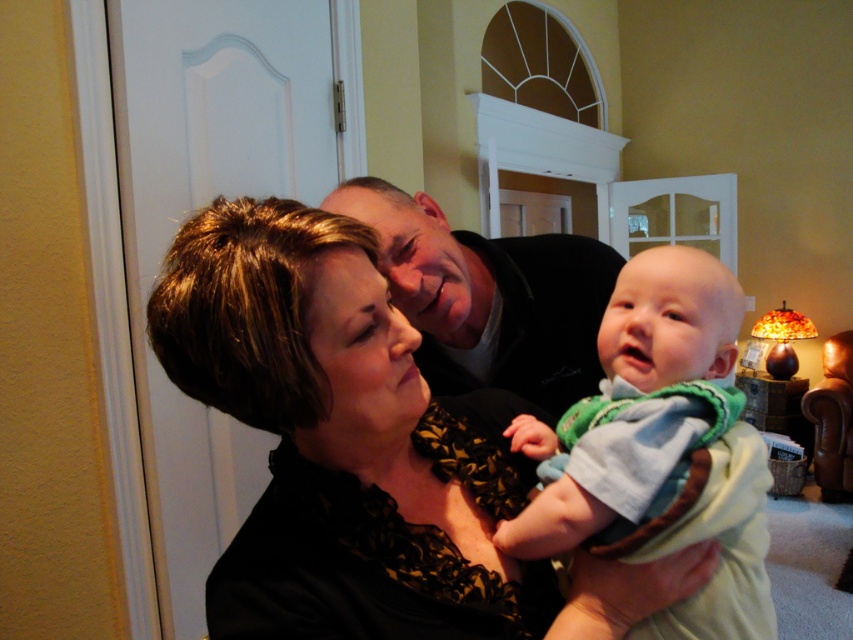
You are a fashion designer observing the image. You need to determine which clothing item is positioned higher on the woman. Which one is taller between the black lace blouse at center and the soft green knit sweater at center?

The black lace blouse at center is much taller than the soft green knit sweater at center.

Consider the image. In the living room scene described, there is a point marked at coordinates (357, 449). According to the scene details, what object or clothing item is located at this specific coordinate?

The point at coordinates (357, 449) marks the location of the black lace blouse at center.

You are a photographer trying to capture the baby in the center of the image. The baby is currently at point (357, 449). Is the baby positioned at the center of the image?

The point (357, 449) corresponds to the black lace blouse at center, so the baby is not at the center of the image.